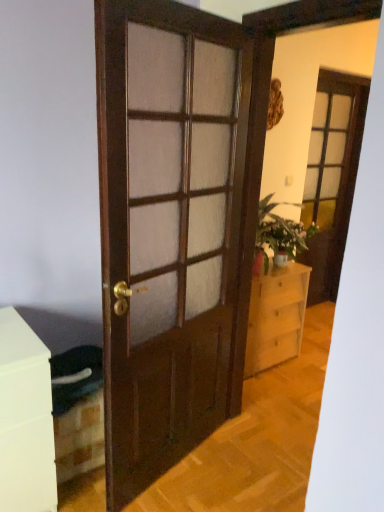
Identify the location of vacant area that is situated to the right of wooden door at center. (227, 463).